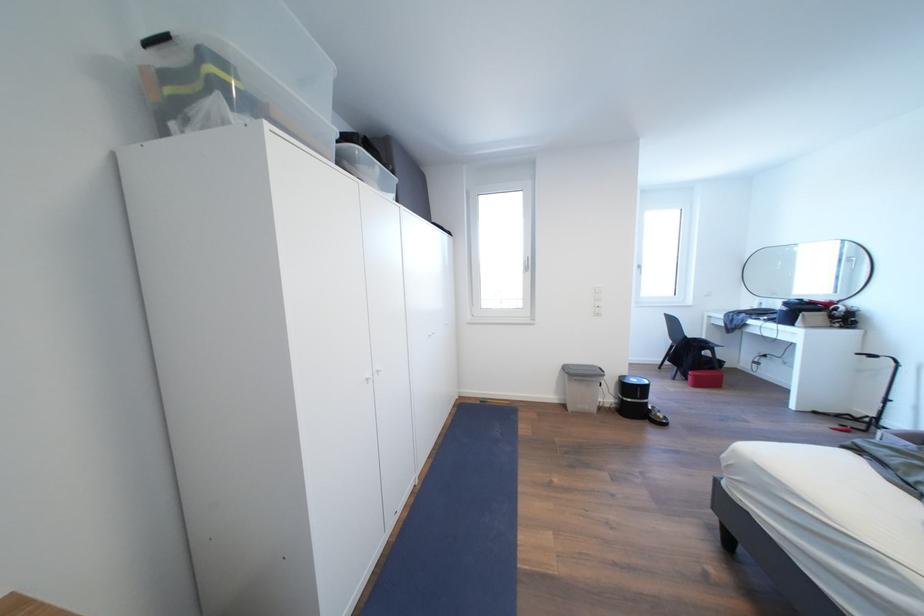
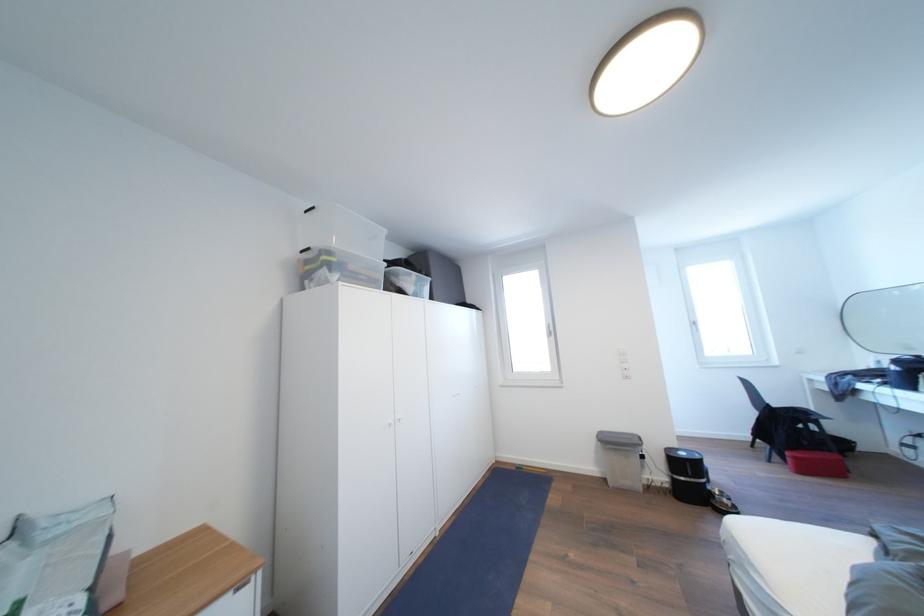
Locate, in the second image, the point that corresponds to point 487,407 in the first image.

(521, 472)